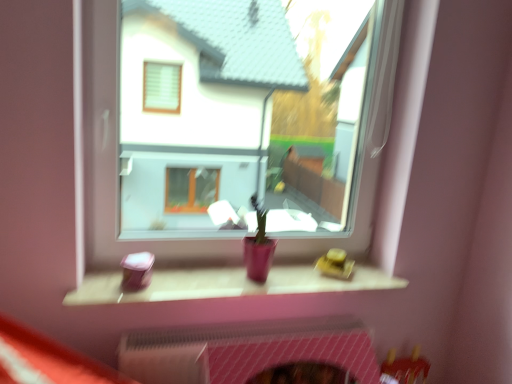
Question: Is pink mesh fireplace at lower center bigger or smaller than matte pink wood at center?

Choices:
 (A) small
 (B) big

Answer: (B)

Question: From the image's perspective, relative to matte pink wood at center, is pink mesh fireplace at lower center above or below?

Choices:
 (A) above
 (B) below

Answer: (B)

Question: Considering the real-world distances, which object is farthest from the transparent glass window at center?

Choices:
 (A) matte pink wood at center
 (B) pink mesh fireplace at lower center

Answer: (B)

Question: Which object is the farthest from the matte pink wood at center?

Choices:
 (A) transparent glass window at center
 (B) pink mesh fireplace at lower center

Answer: (A)